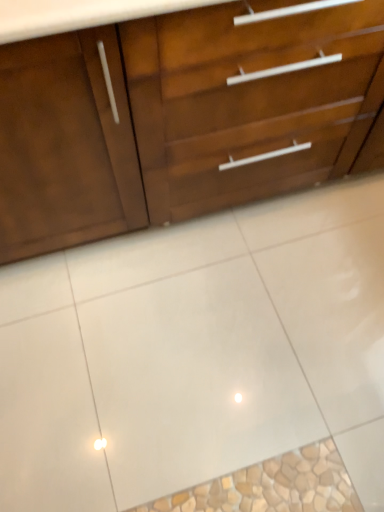
Question: Is white glossy tile at center taller or shorter than matte wood chest of drawers at upper center?

Choices:
 (A) tall
 (B) short

Answer: (B)

Question: Is white glossy tile at center spatially inside matte wood chest of drawers at upper center, or outside of it?

Choices:
 (A) inside
 (B) outside

Answer: (B)

Question: From a real-world perspective, is white glossy tile at center positioned above or below matte wood chest of drawers at upper center?

Choices:
 (A) below
 (B) above

Answer: (A)

Question: From the image's perspective, is matte wood chest of drawers at upper center located above or below white glossy tile at center?

Choices:
 (A) above
 (B) below

Answer: (A)

Question: Is matte wood chest of drawers at upper center wider or thinner than white glossy tile at center?

Choices:
 (A) thin
 (B) wide

Answer: (A)

Question: In terms of height, does matte wood chest of drawers at upper center look taller or shorter compared to white glossy tile at center?

Choices:
 (A) tall
 (B) short

Answer: (A)

Question: Is matte wood chest of drawers at upper center inside or outside of white glossy tile at center?

Choices:
 (A) inside
 (B) outside

Answer: (B)